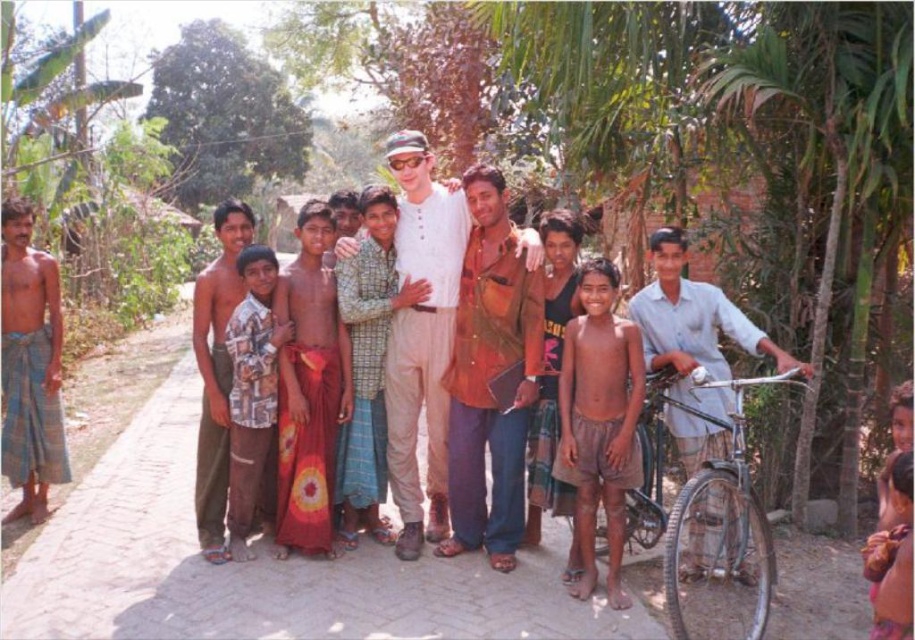
You are organizing a clothing donation drive and need to determine if the brown leather jacket at center and the brown cotton shorts at center can be placed side by side on a shelf that is 1 meter wide. Based on their sizes, will they fit together?

The brown leather jacket at center is wider than the brown cotton shorts at center. However, since the total width of both items combined is not provided, it is impossible to determine if they will fit on the 1 meter wide shelf without additional information.

You are standing at the position of point [205,396] and want to walk towards point [686,493]. Which direction should you move relative to the other point?

You should move forward towards point [686,493] since it is in front of point [205,396].